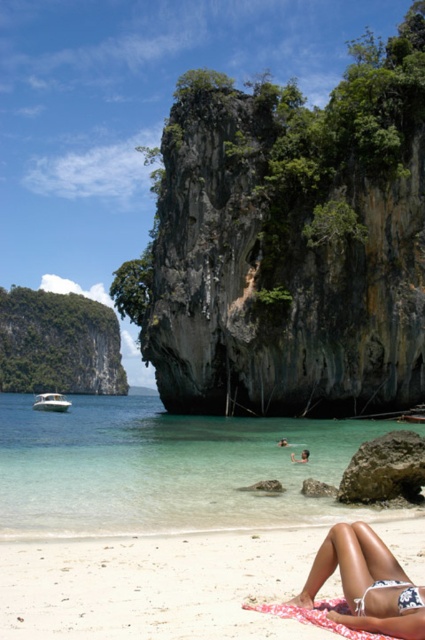
You are a photographer taking a picture of the beach scene. You want to ensure both the white fabric bikini top at lower right and the white glossy boat at left are clearly visible. Which object will appear larger in the photo due to its proximity to the camera?

The white fabric bikini top at lower right will appear larger in the photo because it is closer to the viewer than the white glossy boat at left.

In the scene shown: You are a tourist standing on the white sandy beach at lower center and want to reach the clear water at center. Based on the scene, can you walk directly towards the water without crossing any obstacles?

The white sandy beach at lower center is behind clear water at center, so you can walk directly towards the water without crossing any obstacles.

You are a photographer taking a picture of the serene beach scene. You notice the white fabric bikini top at lower right and the white glossy boat at left in your frame. Which object appears higher in the image?

The white fabric bikini top at lower right appears higher in the image than the white glossy boat at left because it is positioned above it.